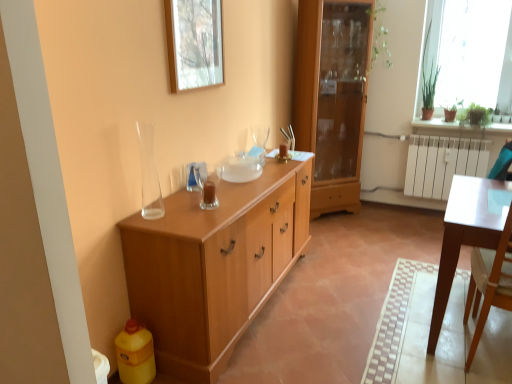
I want to click on free space to the right of transparent glass vase at left, so [182, 209].